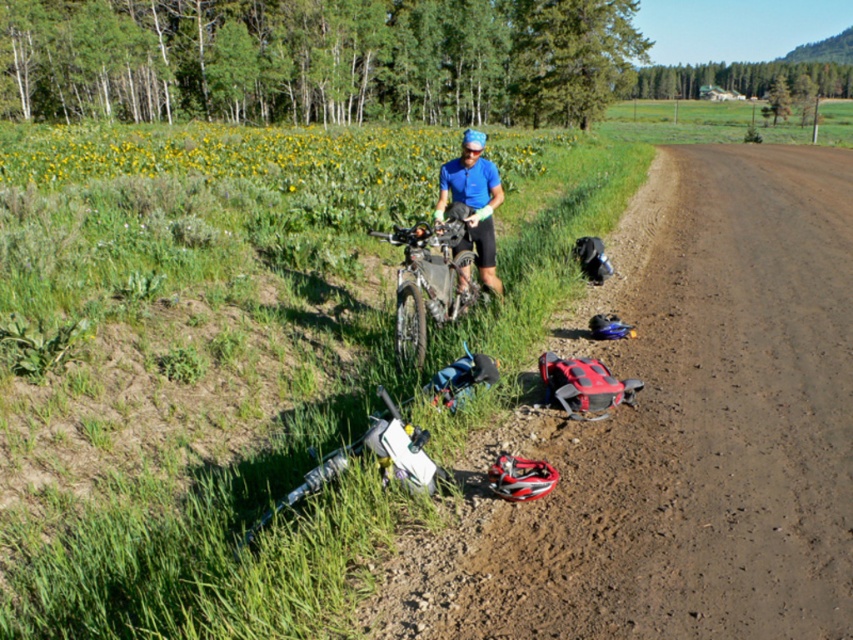
Question: Is brown dirt track at lower right smaller than silver metallic mountain bike at center?

Choices:
 (A) no
 (B) yes

Answer: (A)

Question: Estimate the real-world distances between objects in this image. Which object is closer to the brown dirt track at lower right?

Choices:
 (A) white matte mountain bike at lower left
 (B) silver metallic mountain bike at center

Answer: (A)

Question: Considering the real-world distances, which object is closest to the white matte mountain bike at lower left?

Choices:
 (A) brown dirt track at lower right
 (B) silver metallic mountain bike at center

Answer: (B)

Question: Does brown dirt track at lower right have a larger size compared to silver metallic mountain bike at center?

Choices:
 (A) yes
 (B) no

Answer: (A)

Question: Does brown dirt track at lower right appear under silver metallic mountain bike at center?

Choices:
 (A) yes
 (B) no

Answer: (B)

Question: Considering the real-world distances, which object is closest to the brown dirt track at lower right?

Choices:
 (A) white matte mountain bike at lower left
 (B) silver metallic mountain bike at center

Answer: (A)